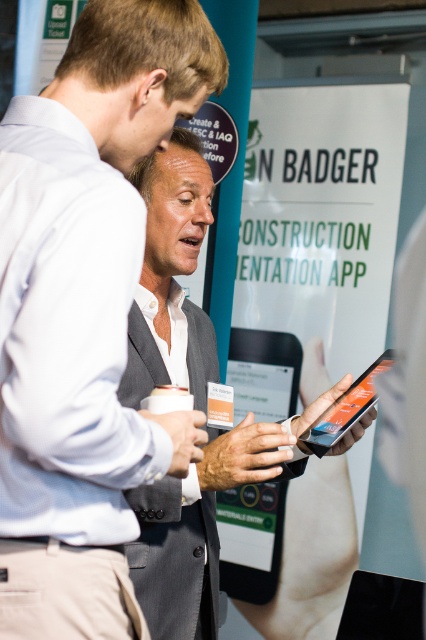
Find the location of a particular element. This screenshot has width=426, height=640. gray suit jacket at center is located at coordinates (199, 524).

Does gray suit jacket at center have a greater width compared to black matte tablet at center?

Yes.

Image resolution: width=426 pixels, height=640 pixels. In order to click on gray suit jacket at center in this screenshot , I will do `click(199, 524)`.

Identify the location of gray suit jacket at center. (199, 524).

Which is more to the left, gray fabric suit at center or gray suit jacket at center?

From the viewer's perspective, gray fabric suit at center appears more on the left side.

Which of these two, gray fabric suit at center or gray suit jacket at center, stands taller?

With more height is gray suit jacket at center.

Which is behind, point (31, 625) or point (314, 412)?

The point (314, 412) is more distant.

You are a GUI agent. You are given a task and a screenshot of the screen. Output one action in this format:
    pyautogui.click(x=<x>, y=<y>)
    Task: Click on the gray fabric suit at center
    This screenshot has width=426, height=640.
    Given the screenshot: What is the action you would take?
    pyautogui.click(x=86, y=314)

Which is more to the left, gray fabric suit at center or black matte tablet at center?

gray fabric suit at center

Based on the photo, is gray fabric suit at center above black matte tablet at center?

Correct, gray fabric suit at center is located above black matte tablet at center.

Which is in front, point (45, 156) or point (238, 552)?

Point (45, 156)

Locate an element on the screen. This screenshot has width=426, height=640. gray fabric suit at center is located at coordinates (86, 314).